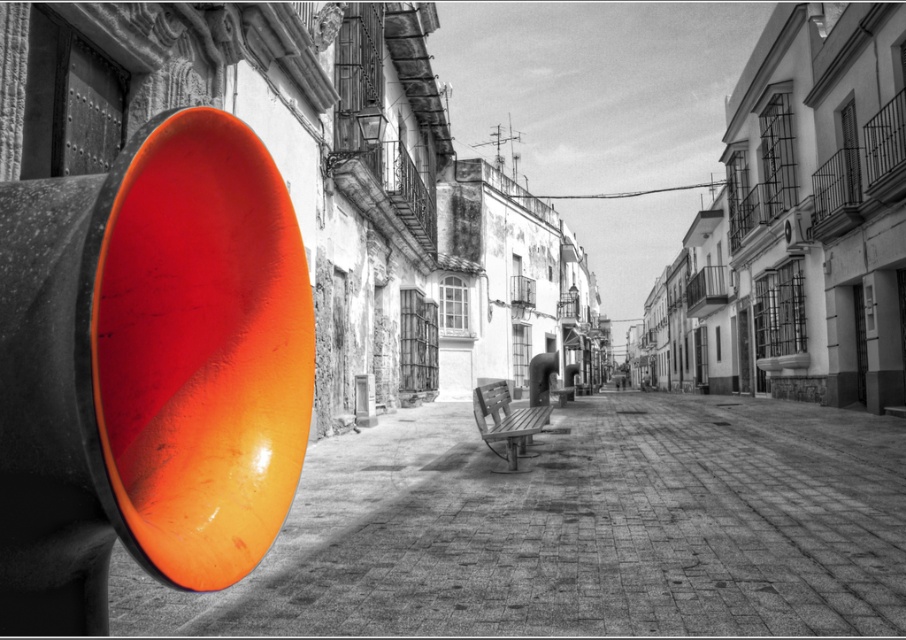
Question: Does glossy orange disc at left lie behind glossy orange traffic light at left?

Choices:
 (A) yes
 (B) no

Answer: (A)

Question: Which point is farther from the camera taking this photo?

Choices:
 (A) (897, 438)
 (B) (171, 157)

Answer: (A)

Question: Is glossy orange disc at left above wooden bench at center?

Choices:
 (A) yes
 (B) no

Answer: (B)

Question: Is glossy orange disc at left smaller than wooden bench at center?

Choices:
 (A) no
 (B) yes

Answer: (A)

Question: Which of these objects is positioned farthest from the wooden bench at center?

Choices:
 (A) glossy orange traffic light at left
 (B) glossy orange disc at left

Answer: (A)

Question: Which point is closer to the camera?

Choices:
 (A) glossy orange traffic light at left
 (B) glossy orange disc at left

Answer: (A)